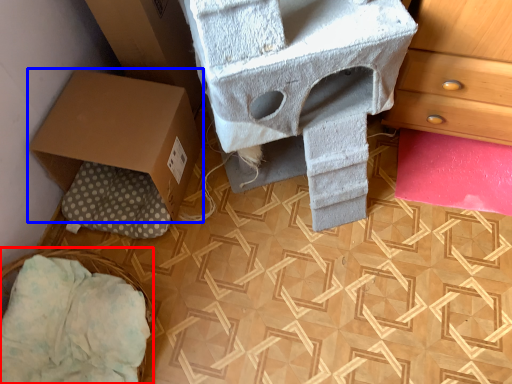
Question: Which point is closer to the camera, basket (highlighted by a red box) or box (highlighted by a blue box)?

Choices:
 (A) basket
 (B) box

Answer: (A)